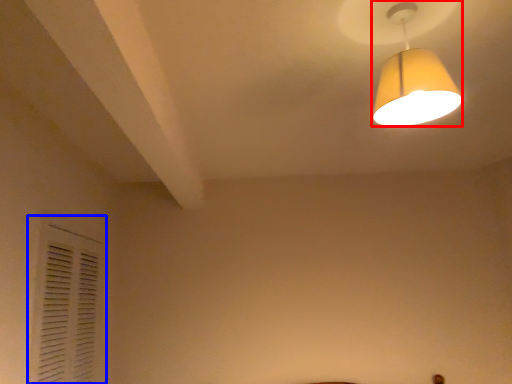
Question: Which object appears farthest to the camera in this image, lamp (highlighted by a red box) or shutter (highlighted by a blue box)?

Choices:
 (A) lamp
 (B) shutter

Answer: (B)